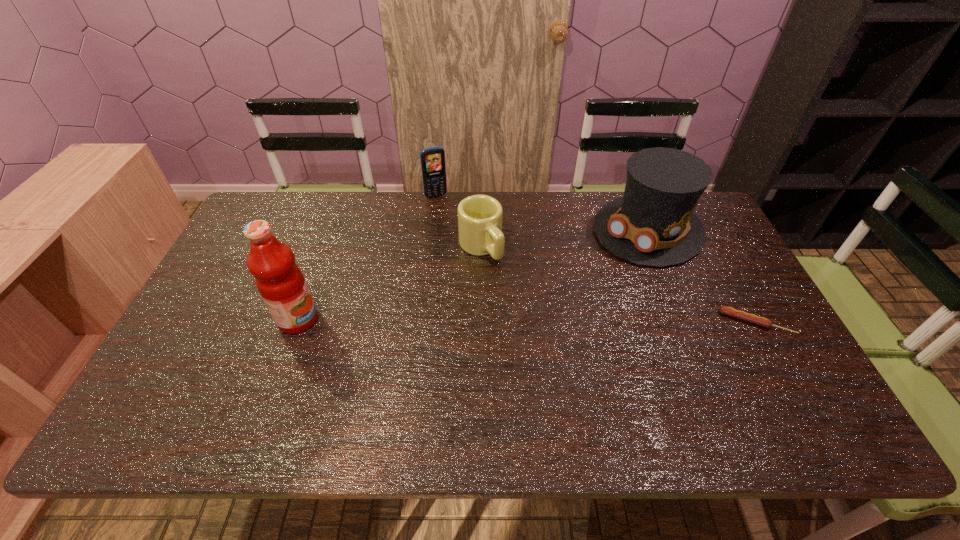
This screenshot has width=960, height=540. Find the location of `free space on the desktop that is between the fruit juice and the shortest object and is positioned with goggles on the front of the second tallest object`. free space on the desktop that is between the fruit juice and the shortest object and is positioned with goggles on the front of the second tallest object is located at coordinates (543, 321).

Locate an element on the screen. The image size is (960, 540). vacant space on the desktop that is between the leftmost object and the sausage and is positioned with the handle on the side of the second shortest object is located at coordinates (542, 321).

Where is `vacant spot on the desktop that is between the tallest object and the sausage and is positioned on the screen of the third shortest object`? The height and width of the screenshot is (540, 960). vacant spot on the desktop that is between the tallest object and the sausage and is positioned on the screen of the third shortest object is located at coordinates (494, 321).